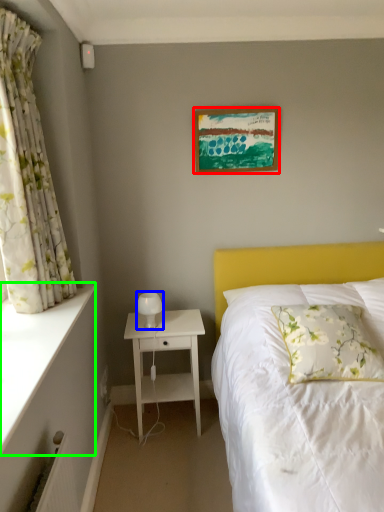
Question: Estimate the real-world distances between objects in this image. Which object is closer to picture frame (highlighted by a red box), table lamp (highlighted by a blue box) or ledge (highlighted by a green box)?

Choices:
 (A) table lamp
 (B) ledge

Answer: (A)